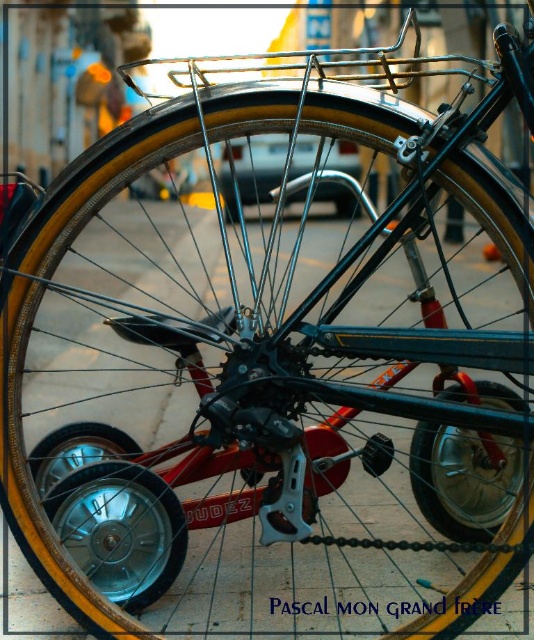
Does shiny metallic wheel at lower left come in front of shiny metallic tire at center?

No, it is not.

Is shiny metallic wheel at lower left behind shiny metallic tire at center?

Yes, shiny metallic wheel at lower left is behind shiny metallic tire at center.

Between point (132, 497) and point (480, 436), which one is positioned in front?

Point (132, 497) is in front.

Locate an element on the screen. shiny metallic wheel at lower left is located at coordinates (111, 512).